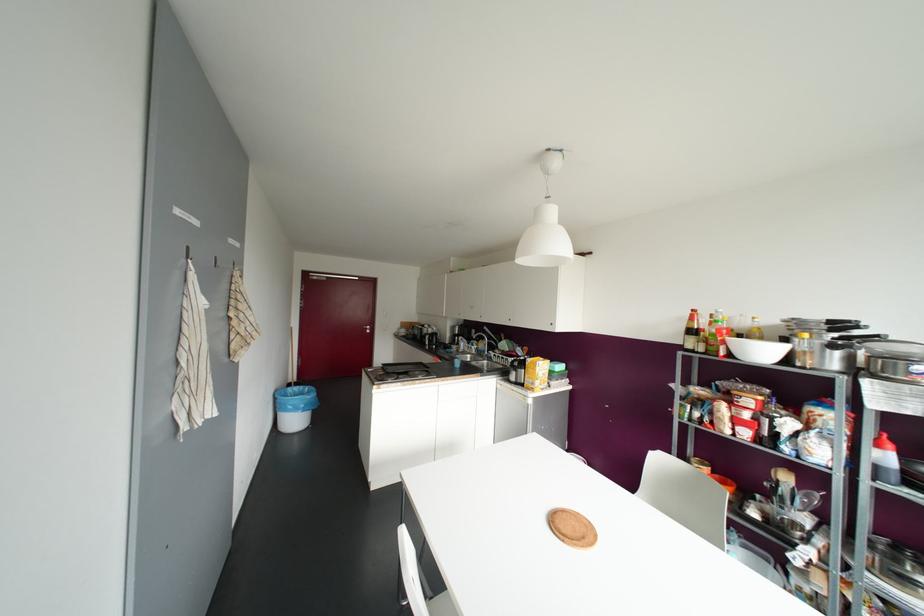
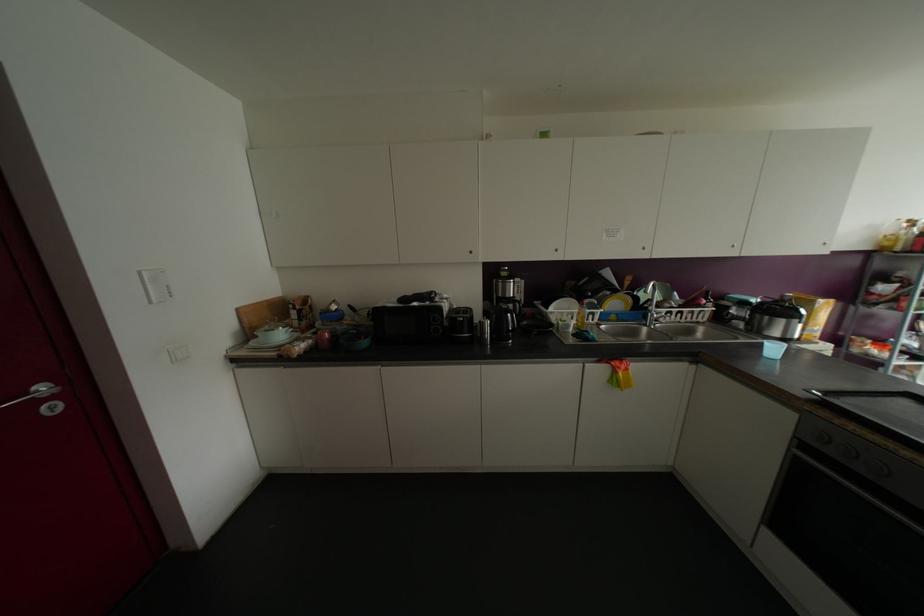
In the second image, find the point that corresponds to the point at 409,336 in the first image.

(363, 342)